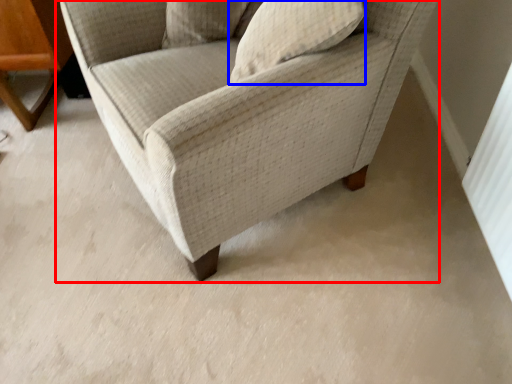
Question: Among these objects, which one is farthest to the camera, chair (highlighted by a red box) or pillow (highlighted by a blue box)?

Choices:
 (A) chair
 (B) pillow

Answer: (B)